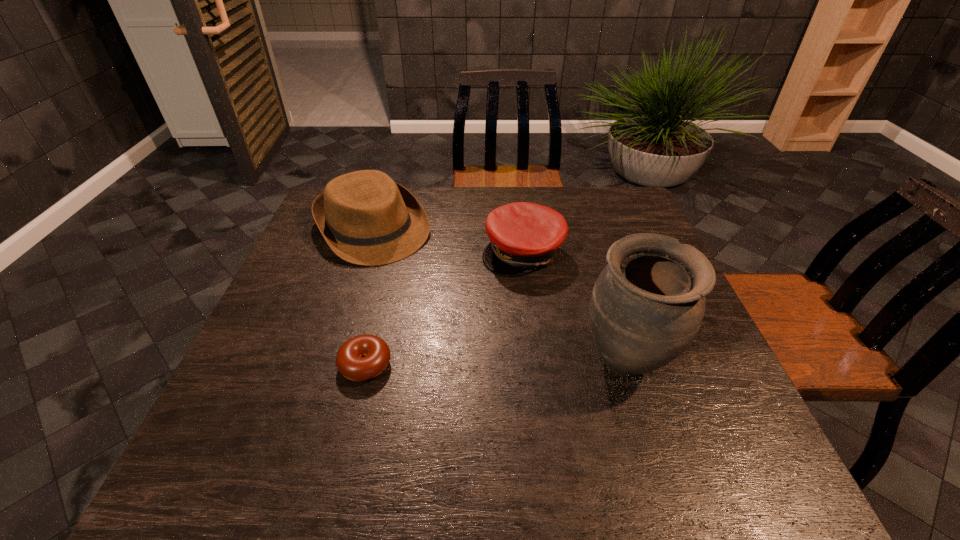
Locate an element on the screen. vacant space on the desktop that is between the doughnut and the urn and is positioned on the front-facing side of the second shortest object is located at coordinates (524, 364).

Identify the location of vacant space on the desktop that is between the doughnut and the tallest object and is positioned on the front-facing side of the second tallest object. (481, 364).